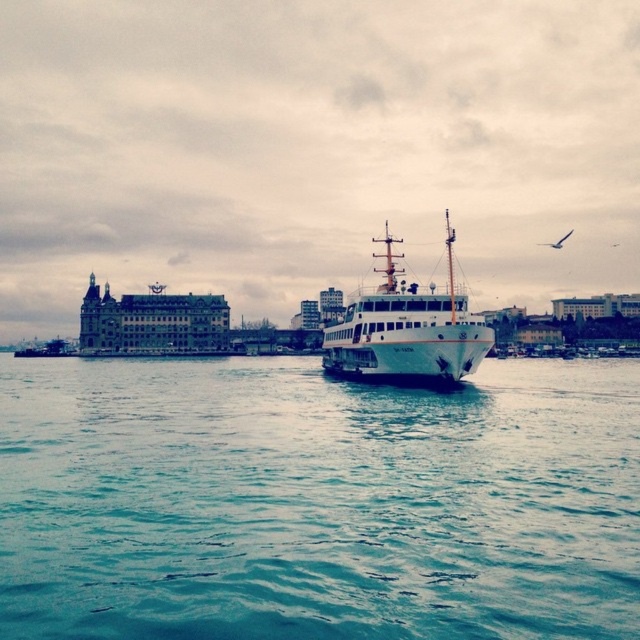
Question: Which point appears closest to the camera in this image?

Choices:
 (A) (58, 573)
 (B) (400, 237)

Answer: (A)

Question: In this image, where is blue water at center located relative to white matte ship at center?

Choices:
 (A) above
 (B) below

Answer: (B)

Question: Is blue water at center thinner than white matte ship at center?

Choices:
 (A) no
 (B) yes

Answer: (A)

Question: Observing the image, what is the correct spatial positioning of blue water at center in reference to white matte ship at center?

Choices:
 (A) above
 (B) below

Answer: (B)